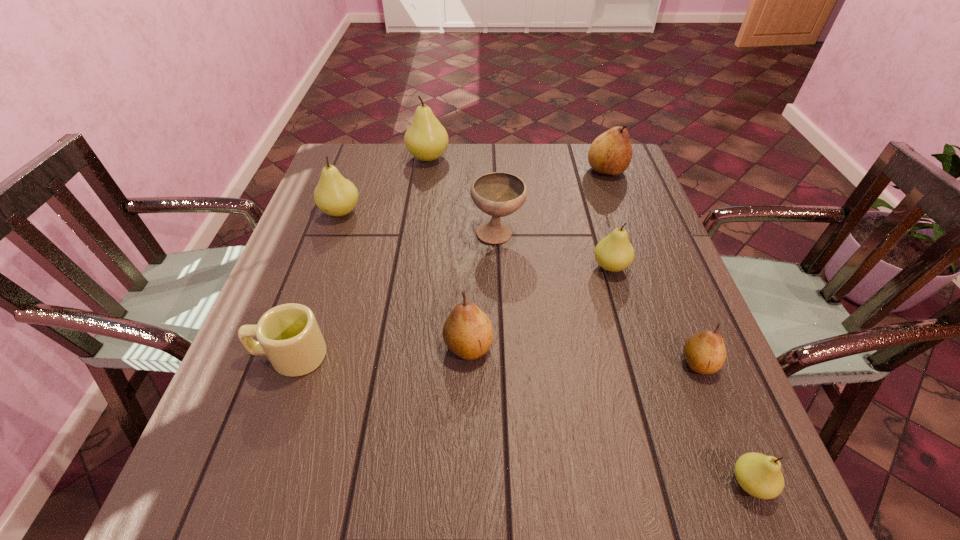
Find the location of a particular element. Image resolution: width=960 pixels, height=540 pixels. unoccupied position between the farthest brown pear and the chalice is located at coordinates (552, 202).

Locate an element on the screen. vacant space that's between the biggest brown pear and the second smallest brown pear is located at coordinates (538, 258).

Where is `blank region between the mug and the third farthest pear`? This screenshot has height=540, width=960. blank region between the mug and the third farthest pear is located at coordinates (315, 284).

Find the location of `empty space between the third smallest green pear and the smallest green pear`. empty space between the third smallest green pear and the smallest green pear is located at coordinates (545, 348).

Locate an element on the screen. The image size is (960, 540). free space between the third farthest green pear and the farthest brown pear is located at coordinates coord(609,219).

At what (x,y) coordinates should I click in order to perform the action: click on the third closest object to the chalice. Please return your answer as a coordinate pair (x, y). This screenshot has width=960, height=540. Looking at the image, I should click on (426, 139).

Image resolution: width=960 pixels, height=540 pixels. I want to click on the third closest object to the nearest green pear, so click(614, 253).

Find the location of a particular element. This screenshot has width=960, height=540. pear that can be found as the closest to the farthest brown pear is located at coordinates (614, 253).

Select which pear is the fourth closest to the beige mug. Please provide its 2D coordinates. Your answer should be formatted as a tuple, i.e. [(x, y)], where the tuple contains the x and y coordinates of a point satisfying the conditions above.

[(426, 139)]

At what (x,y) coordinates should I click in order to perform the action: click on green pear that is the third closest to the third farthest pear. Please return your answer as a coordinate pair (x, y). The width and height of the screenshot is (960, 540). Looking at the image, I should click on (759, 475).